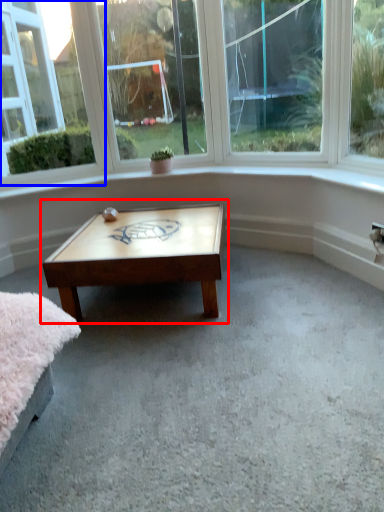
Question: Which point is closer to the camera, coffee table (highlighted by a red box) or window (highlighted by a blue box)?

Choices:
 (A) coffee table
 (B) window

Answer: (A)